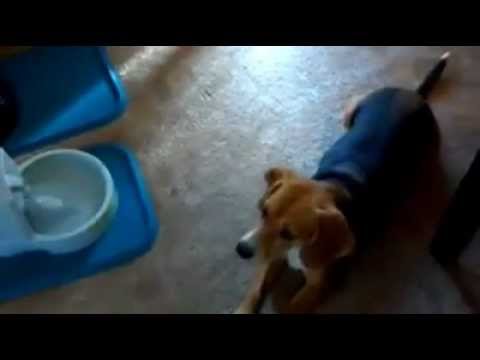
Locate an element on the screen. The image size is (480, 360). floor is located at coordinates (235, 121).